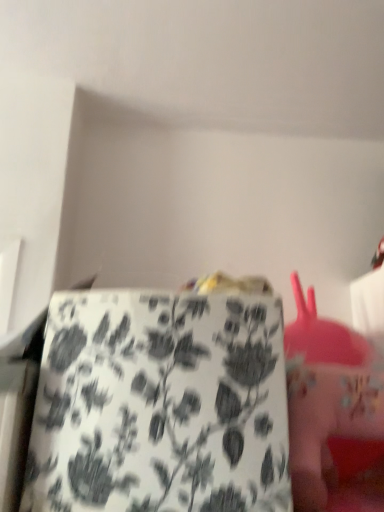
In order to face white floral-patterned box at center, should I rotate leftwards or rightwards?

To align with it, rotate left about 3.653°.

Find the location of a particular element. white floral-patterned box at center is located at coordinates (160, 405).

Describe the element at coordinates (160, 405) in the screenshot. The image size is (384, 512). I see `white floral-patterned box at center` at that location.

The image size is (384, 512). Find the location of `white floral-patterned box at center`. white floral-patterned box at center is located at coordinates (160, 405).